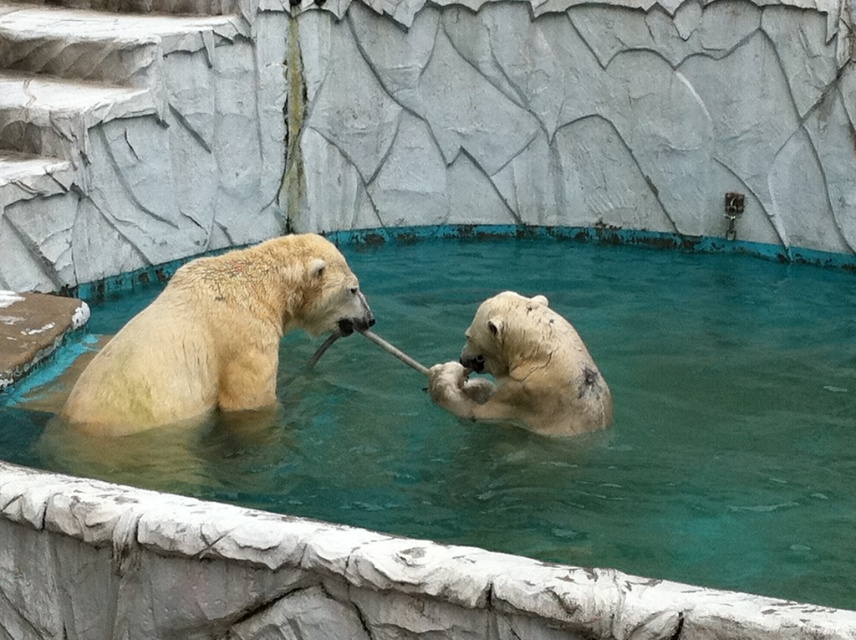
Between point (550, 360) and point (437, 365), which one is positioned in front?

Positioned in front is point (550, 360).

Can you confirm if white fur bear at center is smaller than white fur paw at center?

Actually, white fur bear at center might be larger than white fur paw at center.

Is point (531, 406) behind point (444, 388)?

No, (531, 406) is in front of (444, 388).

You are a GUI agent. You are given a task and a screenshot of the screen. Output one action in this format:
    pyautogui.click(x=<x>, y=<y>)
    Task: Click on the white fur bear at center
    The image size is (856, 640).
    Given the screenshot: What is the action you would take?
    pyautogui.click(x=522, y=371)

Between white fur bear at left and white fur paw at center, which one has less height?

white fur paw at center is shorter.

Does white fur bear at left appear on the left side of white fur paw at center?

Correct, you'll find white fur bear at left to the left of white fur paw at center.

The image size is (856, 640). I want to click on white fur bear at left, so click(217, 336).

Is clear blue water at center positioned before white fur bear at left?

Yes, clear blue water at center is closer to the viewer.

Between clear blue water at center and white fur bear at left, which one is positioned higher?

white fur bear at left is above.

Between point (853, 502) and point (287, 323), which one is positioned behind?

Positioned behind is point (287, 323).

In order to click on clear blue water at center in this screenshot , I will do `click(545, 436)`.